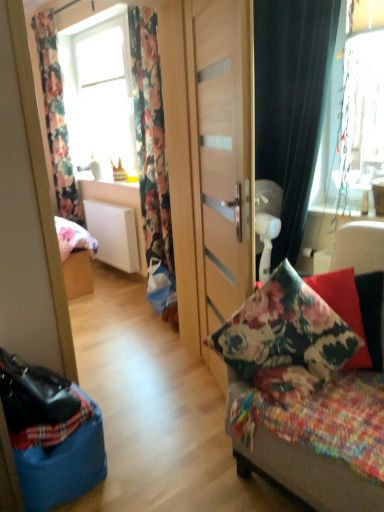
In order to click on floral fabric curtain at left, which is counted as the second curtain, starting from the right in this screenshot , I will do `click(150, 136)`.

Find the location of a particular element. The height and width of the screenshot is (512, 384). fluffy multicolored blanket at right is located at coordinates (x=324, y=420).

In order to click on floral fabric curtain at left, the 2th curtain positioned from the front in this screenshot , I will do `click(150, 136)`.

Are fluffy multicolored blanket at right and floral fabric cushion at center beside each other?

No.

Between fluffy multicolored blanket at right and floral fabric cushion at center, which one appears on the left side from the viewer's perspective?

From the viewer's perspective, fluffy multicolored blanket at right appears more on the left side.

Which is behind, fluffy multicolored blanket at right or floral fabric cushion at center?

fluffy multicolored blanket at right is further away from the camera.

Is white matte radiator at center inside transparent glass window at upper right, which ranks as the second window in back-to-front order?

No, white matte radiator at center is not inside transparent glass window at upper right, which ranks as the second window in back-to-front order.

Which of these two, transparent glass window at upper right, the first window from the right, or white matte radiator at center, is smaller?

Smaller between the two is transparent glass window at upper right, the first window from the right.

From a real-world perspective, is transparent glass window at upper right, the first window from the right, positioned above or below white matte radiator at center?

Clearly, from a real-world perspective, transparent glass window at upper right, the first window from the right, is above white matte radiator at center.

Is transparent glass window at upper right, the second window when ordered from left to right, next to white matte radiator at center?

transparent glass window at upper right, the second window when ordered from left to right, and white matte radiator at center are not in contact.

Is wooden door at center oriented away from floral fabric pillow at right?

wooden door at center does not have its back to floral fabric pillow at right.

In order to click on pillow beneath the wooden door at center (from a real-world perspective) in this screenshot , I will do `click(285, 330)`.

Is wooden door at center smaller than floral fabric pillow at right?

Actually, wooden door at center might be larger than floral fabric pillow at right.

Which of these two, wooden door at center or floral fabric pillow at right, stands taller?

Standing taller between the two is wooden door at center.

You are a GUI agent. You are given a task and a screenshot of the screen. Output one action in this format:
    pyautogui.click(x=<x>, y=<y>)
    Task: Click on the furniture that appears above the white matte radiator at center (from a real-world perspective)
    This screenshot has width=384, height=512.
    Given the screenshot: What is the action you would take?
    pyautogui.click(x=301, y=467)

Is floral fabric cushion at center oriented towards white matte radiator at center?

No, floral fabric cushion at center is not facing towards white matte radiator at center.

Relative to white matte radiator at center, is floral fabric cushion at center in front or behind?

floral fabric cushion at center is in front of white matte radiator at center.

Is there a large distance between floral fabric curtain at left, which is counted as the second curtain, starting from the right, and transparent glass window at upper left, which appears as the second window when viewed from the right?

floral fabric curtain at left, which is counted as the second curtain, starting from the right, is far away from transparent glass window at upper left, which appears as the second window when viewed from the right.

Is point (136, 88) farther from viewer compared to point (81, 123)?

No, it is in front of (81, 123).

Measure the distance between floral fabric curtain at left, the 2th curtain viewed from the left, and transparent glass window at upper left, which ranks as the 2th window in front-to-back order.

The distance of floral fabric curtain at left, the 2th curtain viewed from the left, from transparent glass window at upper left, which ranks as the 2th window in front-to-back order, is 1.25 meters.

Based on their sizes in the image, would you say floral fabric curtain at left, which is counted as the second curtain, starting from the right, is bigger or smaller than transparent glass window at upper left, which appears as the second window when viewed from the right?

In the image, floral fabric curtain at left, which is counted as the second curtain, starting from the right, appears to be larger than transparent glass window at upper left, which appears as the second window when viewed from the right.

From a real-world perspective, who is located lower, white matte radiator at center or floral fabric curtain at left, the second curtain viewed from the back?

white matte radiator at center, from a real-world perspective.

In the scene shown: Choose the correct answer: Is white matte radiator at center inside floral fabric curtain at left, the 2th curtain positioned from the front, or outside it?

The correct answer is: outside.

Where is `cabinetry that appears behind the floral fabric curtain at left, the second curtain viewed from the back`? The width and height of the screenshot is (384, 512). cabinetry that appears behind the floral fabric curtain at left, the second curtain viewed from the back is located at coordinates (118, 204).

In terms of height, does white matte radiator at center look taller or shorter compared to floral fabric curtain at left, the 2th curtain positioned from the front?

Clearly, white matte radiator at center is shorter compared to floral fabric curtain at left, the 2th curtain positioned from the front.

From a real-world perspective, which object stands above the other?

Answer: From a 3D spatial view, floral fabric curtain at upper left, which is counted as the third curtain, starting from the right, is above.

Is black velvet curtain at right, which is the 1th curtain in right-to-left order, inside or outside of floral fabric curtain at upper left, which is counted as the third curtain, starting from the right?

The correct answer is: outside.

Considering the sizes of objects black velvet curtain at right, which is the 1th curtain in right-to-left order, and floral fabric curtain at upper left, which appears as the 3th curtain when viewed from the front, in the image provided, who is taller, black velvet curtain at right, which is the 1th curtain in right-to-left order, or floral fabric curtain at upper left, which appears as the 3th curtain when viewed from the front,?

With more height is floral fabric curtain at upper left, which appears as the 3th curtain when viewed from the front.

Locate an element on the screen. The image size is (384, 512). furniture that appears in front of the fluffy multicolored blanket at right is located at coordinates (301, 467).

This screenshot has width=384, height=512. Find the location of `window that is the 1st one when counting upward from the white matte radiator at center (from the image's perspective)`. window that is the 1st one when counting upward from the white matte radiator at center (from the image's perspective) is located at coordinates (356, 111).

Considering their positions, is floral fabric curtain at left, the second curtain viewed from the back, positioned further to wooden door at center than transparent glass window at upper left, arranged as the 1th window when viewed from the back?

transparent glass window at upper left, arranged as the 1th window when viewed from the back, lies further to wooden door at center than the other object.

Which object lies further to the anchor point fluffy multicolored blanket at right, transparent glass window at upper right, the second window when ordered from left to right, or floral fabric pillow at right?

transparent glass window at upper right, the second window when ordered from left to right, is further to fluffy multicolored blanket at right.

Which object lies nearer to the anchor point wooden door at center, floral fabric curtain at upper left, which is the 1th curtain from back to front, or floral fabric cushion at center?

floral fabric cushion at center is closer to wooden door at center.

From the image, which object appears to be nearer to floral fabric cushion at center, floral fabric curtain at upper left, which is counted as the third curtain, starting from the right, or black velvet curtain at right, which is the 1th curtain in right-to-left order?

black velvet curtain at right, which is the 1th curtain in right-to-left order.

Based on the photo, from the image, which object appears to be farther from black velvet curtain at right, the 1th curtain viewed from the front, floral fabric pillow at right or transparent glass window at upper left, arranged as the 1th window when viewed from the back?

Among the two, transparent glass window at upper left, arranged as the 1th window when viewed from the back, is located further to black velvet curtain at right, the 1th curtain viewed from the front.

Looking at the image, which one is located further to white matte radiator at center, wooden door at center or floral fabric pillow at right?

Among the two, floral fabric pillow at right is located further to white matte radiator at center.

From the picture: From the image, which object appears to be farther from wooden door at center, floral fabric curtain at left, the 2th curtain viewed from the left, or black velvet curtain at right, which is the 1th curtain in right-to-left order?

floral fabric curtain at left, the 2th curtain viewed from the left, is positioned further to the anchor wooden door at center.

Considering their positions, is floral fabric curtain at upper left, the 1th curtain viewed from the left, positioned further to floral fabric pillow at right than fluffy multicolored blanket at right?

The object further to floral fabric pillow at right is floral fabric curtain at upper left, the 1th curtain viewed from the left.

Locate an element on the screen. pillow located between floral fabric cushion at center and transparent glass window at upper left, arranged as the 1th window when viewed from the back, in the depth direction is located at coordinates (285, 330).

Locate an element on the screen. The height and width of the screenshot is (512, 384). bedding between floral fabric cushion at center and transparent glass window at upper left, the 1th window positioned from the left, in the front-back direction is located at coordinates (324, 420).

You are a GUI agent. You are given a task and a screenshot of the screen. Output one action in this format:
    pyautogui.click(x=<x>, y=<y>)
    Task: Click on the pillow between wooden door at center and floral fabric curtain at left, the 2th curtain positioned from the front, along the z-axis
    
    Given the screenshot: What is the action you would take?
    pyautogui.click(x=285, y=330)

The width and height of the screenshot is (384, 512). Identify the location of pillow between wooden door at center and floral fabric cushion at center in the up-down direction. (285, 330).